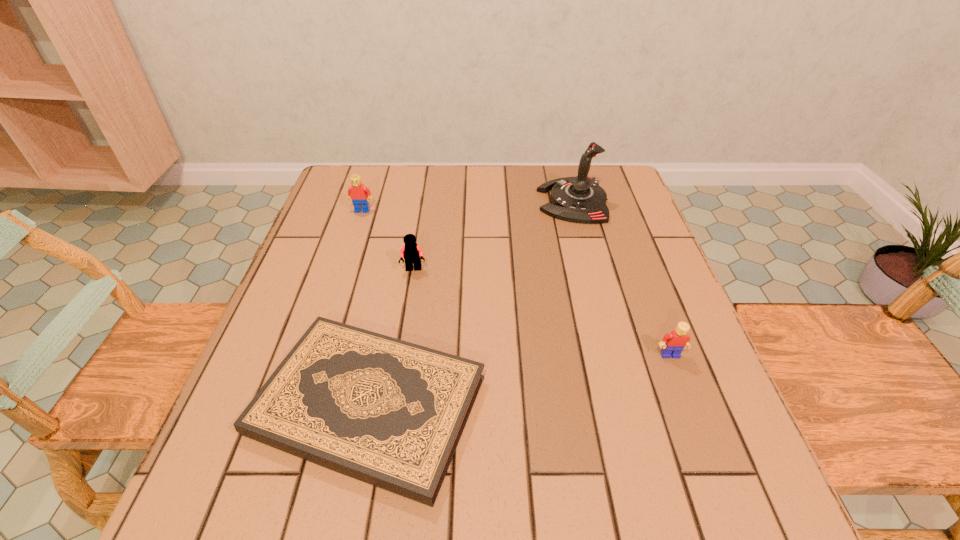
I want to click on vacant region located 0.390m on the front-facing side of the second farthest Lego, so [x=387, y=440].

The height and width of the screenshot is (540, 960). Identify the location of free space located 0.090m on the face of the rightmost Lego. (688, 402).

Locate an element on the screen. blank space located 0.230m on the back of the hardback book is located at coordinates (399, 255).

Locate an element on the screen. joystick located at the far edge is located at coordinates (580, 199).

Where is `Lego that is at the far edge`? The image size is (960, 540). Lego that is at the far edge is located at coordinates (359, 194).

You are a GUI agent. You are given a task and a screenshot of the screen. Output one action in this format:
    pyautogui.click(x=<x>, y=<y>)
    Task: Click on the object present at the near edge
    
    Given the screenshot: What is the action you would take?
    pyautogui.click(x=390, y=413)

Where is `Lego that is at the left edge`? Lego that is at the left edge is located at coordinates (359, 194).

You are a GUI agent. You are given a task and a screenshot of the screen. Output one action in this format:
    pyautogui.click(x=<x>, y=<y>)
    Task: Click on the hardback book at the left edge
    The image size is (960, 540).
    Given the screenshot: What is the action you would take?
    pyautogui.click(x=390, y=413)

Image resolution: width=960 pixels, height=540 pixels. In order to click on joystick that is at the right edge in this screenshot , I will do `click(580, 199)`.

Where is `Lego that is positioned at the right edge`? The image size is (960, 540). Lego that is positioned at the right edge is located at coordinates (672, 344).